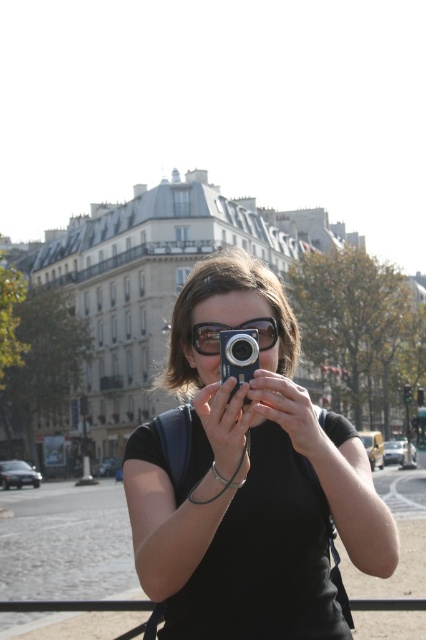
You are a photographer trying to decide which camera to use for a self portrait. You see both the matte black camera at center and the metallic silver camera at center. Which one is located lower?

The matte black camera at center is positioned under the metallic silver camera at center, so it is located lower.